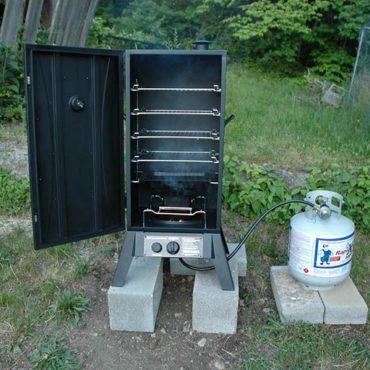
Where is `metal support legs, of smoker, bottom center`? This screenshot has width=370, height=370. metal support legs, of smoker, bottom center is located at coordinates (223, 270), (124, 272).